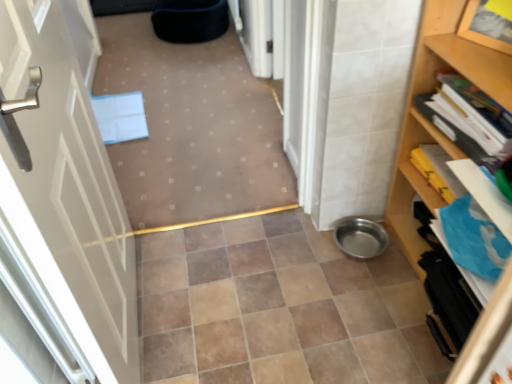
Image resolution: width=512 pixels, height=384 pixels. What are the coordinates of `vacant space to the right of white glossy door at left` in the screenshot? It's located at (248, 312).